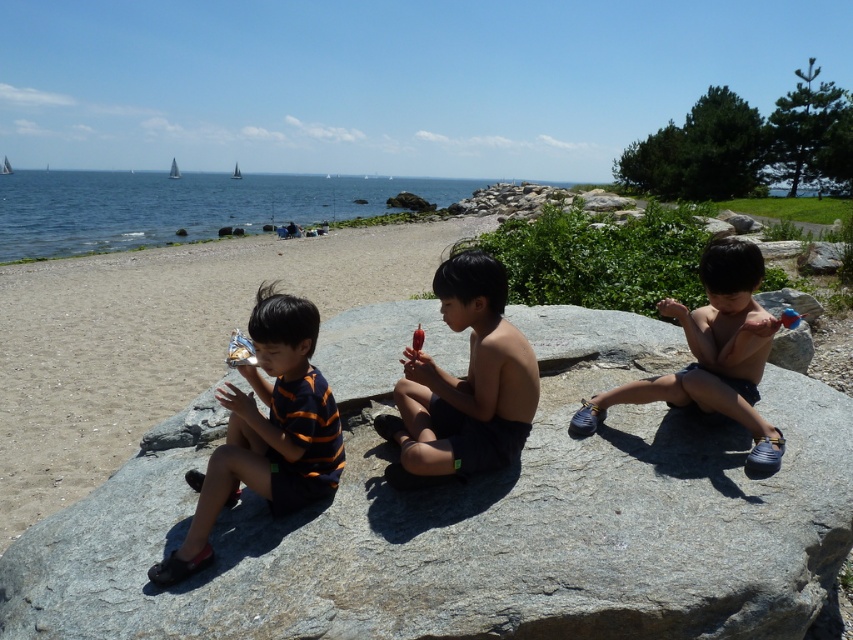
Question: Which of the following is the farthest from the observer?

Choices:
 (A) (523, 435)
 (B) (77, 189)
 (C) (184, 451)
 (D) (294, 416)

Answer: (B)

Question: Can you confirm if gray rough rock at center is positioned to the right of blue water at upper left?

Choices:
 (A) no
 (B) yes

Answer: (B)

Question: Can you confirm if orange striped shirt at left is positioned to the left of nude skin child at center?

Choices:
 (A) no
 (B) yes

Answer: (B)

Question: Estimate the real-world distances between objects in this image. Which object is closer to the nude skin child at center?

Choices:
 (A) blue water at upper left
 (B) orange striped shirt at left
 (C) smooth skin boy at center

Answer: (C)

Question: Which of the following is the farthest from the observer?

Choices:
 (A) (6, 243)
 (B) (683, 312)

Answer: (A)

Question: Does gray rough rock at center have a smaller size compared to smooth skin boy at center?

Choices:
 (A) yes
 (B) no

Answer: (B)